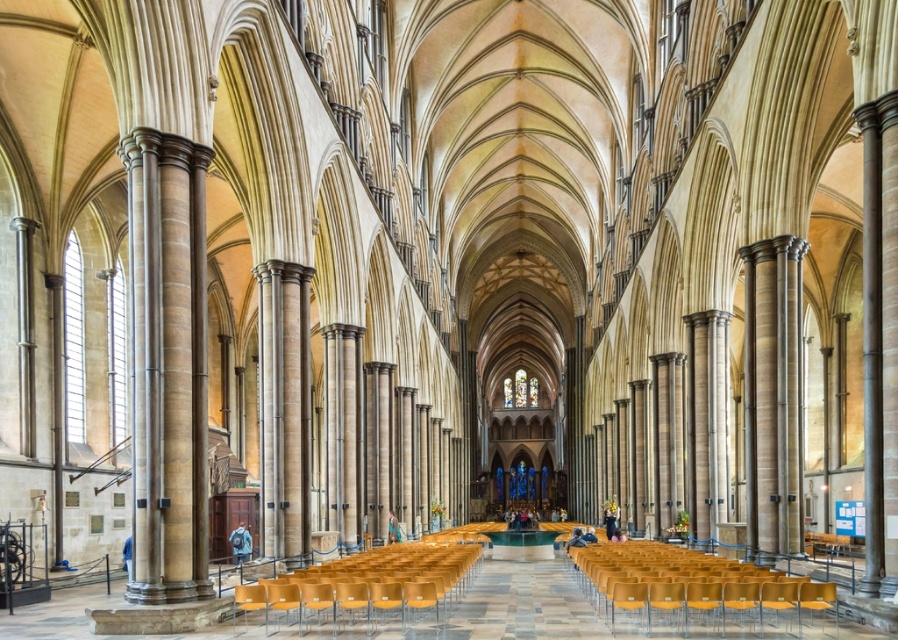
Between matte yellow chairs at lower center and matte yellow chairs at center, which one has more height?

Standing taller between the two is matte yellow chairs at center.

Is the position of matte yellow chairs at lower center more distant than that of matte yellow chairs at center?

No, matte yellow chairs at lower center is closer to the viewer.

Measure the distance between matte yellow chairs at lower center and camera.

The distance of matte yellow chairs at lower center from camera is 148.38 feet.

At what (x,y) coordinates should I click in order to perform the action: click on matte yellow chairs at lower center. Please return your answer as a coordinate pair (x, y). This screenshot has height=640, width=898. Looking at the image, I should click on (692, 582).